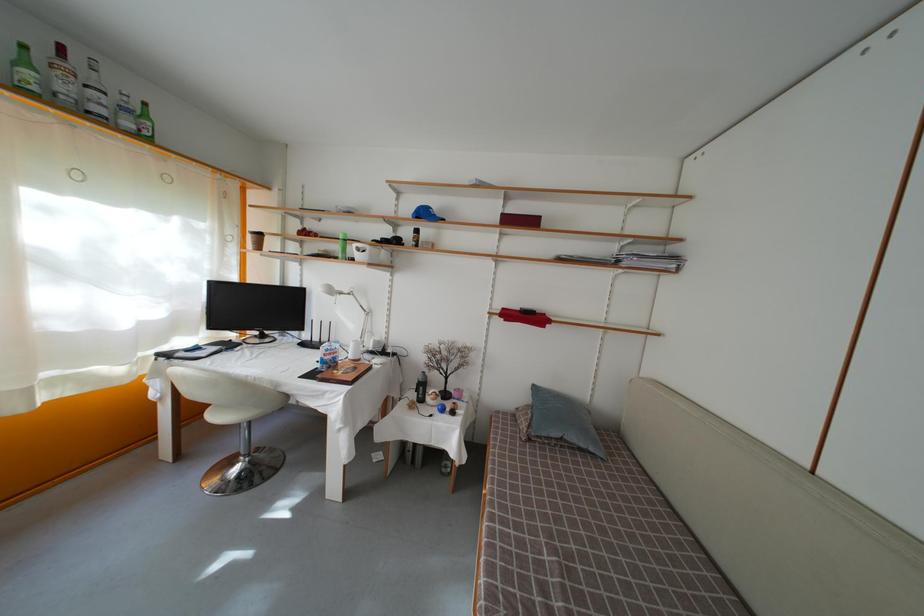
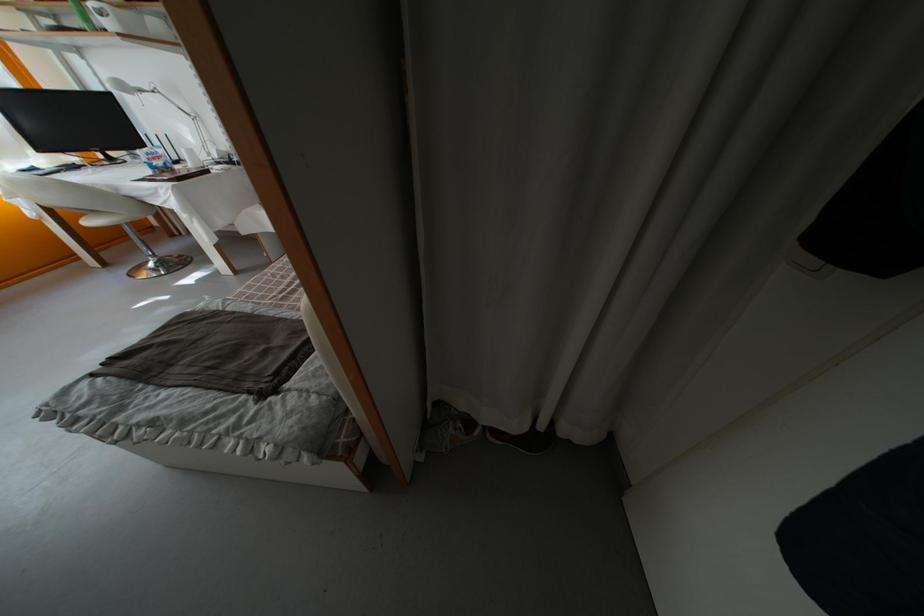
Find the pixel in the second image that matches (360,252) in the first image.

(96, 12)